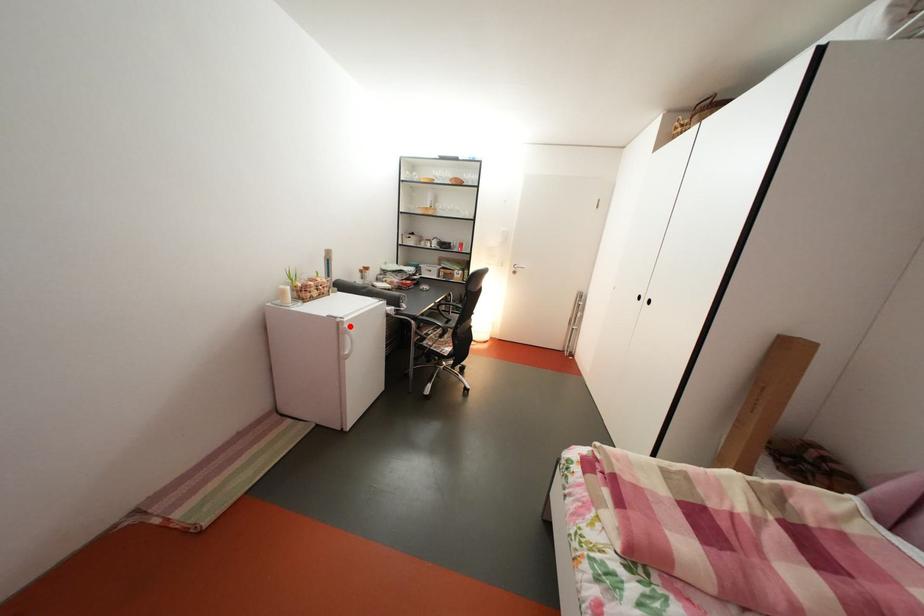
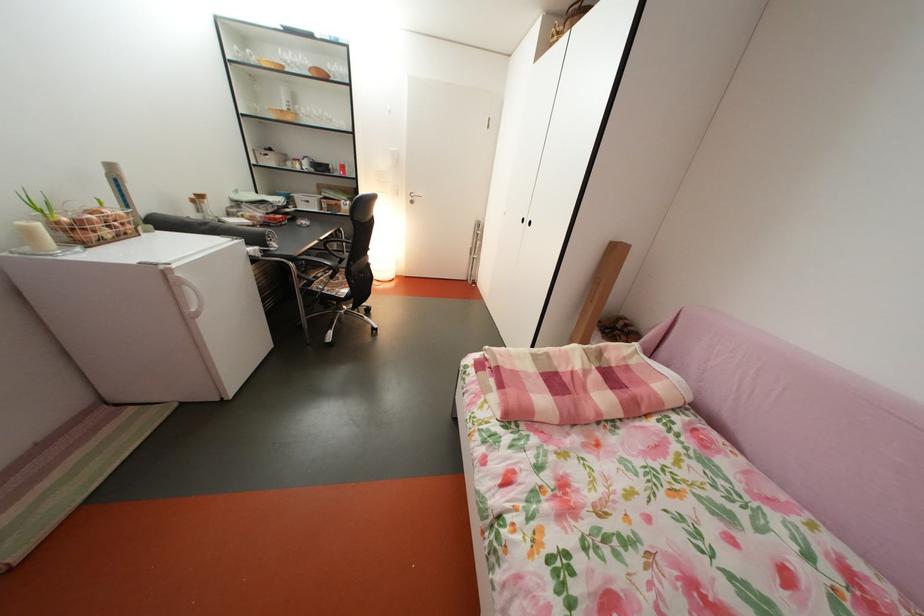
Question: I am providing you with two images of the same scene from different viewpoints. A red point is shown in image1. For the corresponding object point in image2, is it positioned nearer or farther from the camera?

Choices:
 (A) Nearer
 (B) Farther

Answer: (B)